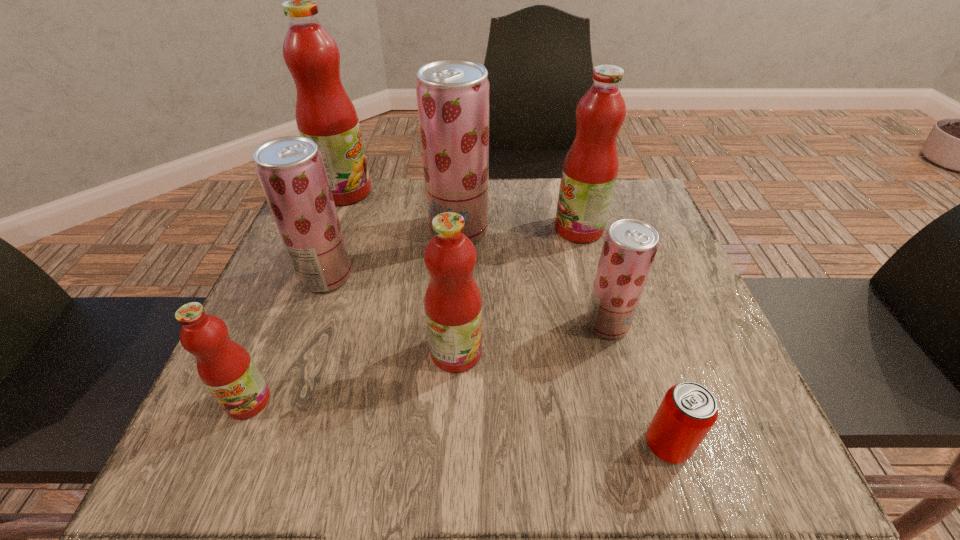
Locate an element on the screen. This screenshot has width=960, height=540. vacant space located 0.230m on the front of the second strawberry fruit juice from right to left is located at coordinates (453, 326).

Identify the location of vacant space located 0.060m on the right of the second nearest strawberry fruit juice. Image resolution: width=960 pixels, height=540 pixels. (380, 276).

Find the location of `free space located on the front label of the third biggest pink fruit juice`. free space located on the front label of the third biggest pink fruit juice is located at coordinates (553, 352).

Identify the location of free space located 0.070m on the front of the nearest strawberry fruit juice. This screenshot has width=960, height=540. (620, 373).

What are the coordinates of `vacant space located 0.390m on the back of the shortest object` in the screenshot? It's located at (610, 262).

At what (x,y) coordinates should I click in order to perform the action: click on fruit juice at the near edge. Please return your answer as a coordinate pair (x, y). The image size is (960, 540). Looking at the image, I should click on (225, 367).

This screenshot has height=540, width=960. Identify the location of can that is at the near edge. (688, 411).

Locate an element on the screen. This screenshot has width=960, height=540. can that is at the right edge is located at coordinates (688, 411).

At what (x,y) coordinates should I click in order to perform the action: click on object situated at the far left corner. Please return your answer as a coordinate pair (x, y). Looking at the image, I should click on (324, 113).

The width and height of the screenshot is (960, 540). In order to click on object situated at the near left corner in this screenshot , I will do `click(225, 367)`.